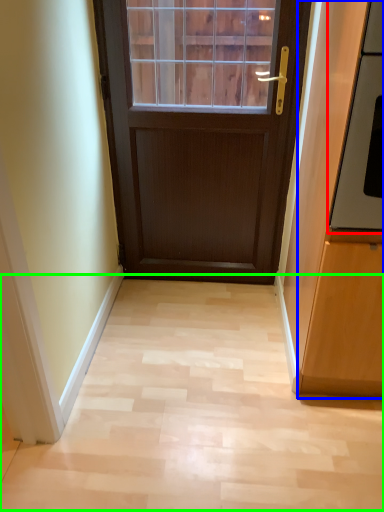
Question: Considering the real-world distances, which object is closest to oven (highlighted by a red box)? cabinetry (highlighted by a blue box) or corridor (highlighted by a green box).

Choices:
 (A) cabinetry
 (B) corridor

Answer: (A)